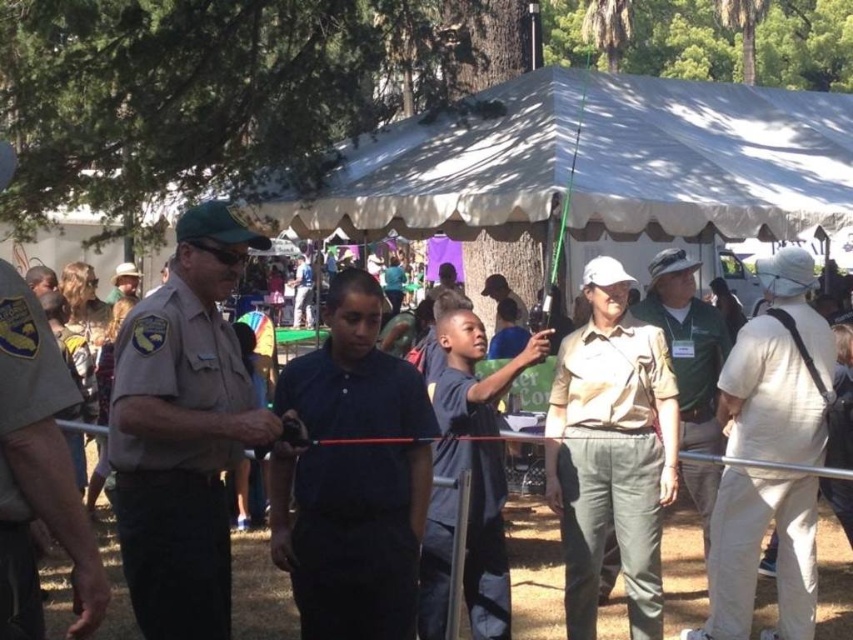
Question: Which object is farther from the camera taking this photo?

Choices:
 (A) brown uniform shirt at center
 (B) tan uniform at center

Answer: (A)

Question: Is the position of beige cotton shirt at right less distant than that of matte khaki uniform at center?

Choices:
 (A) yes
 (B) no

Answer: (A)

Question: Does brown uniform at left have a smaller size compared to brown uniform shirt at center?

Choices:
 (A) no
 (B) yes

Answer: (A)

Question: Which object is the closest to the matte khaki uniform at center?

Choices:
 (A) beige cotton shirt at right
 (B) khaki uniform at center
 (C) brown uniform shirt at center

Answer: (C)

Question: Does tan uniform at center appear under beige cotton shirt at right?

Choices:
 (A) no
 (B) yes

Answer: (A)

Question: Which point appears farthest from the camera in this image?

Choices:
 (A) (292, 308)
 (B) (573, 579)
 (C) (708, 348)

Answer: (A)